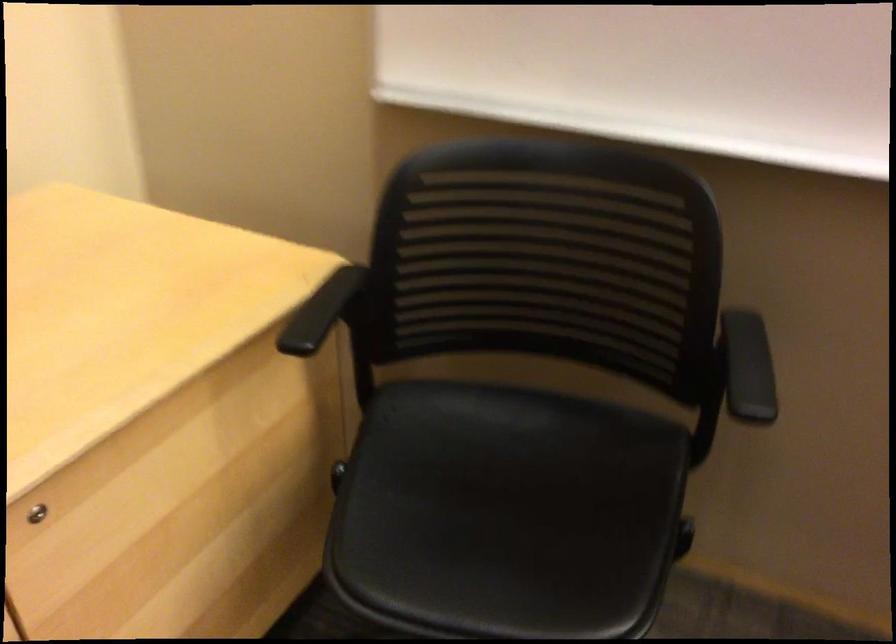
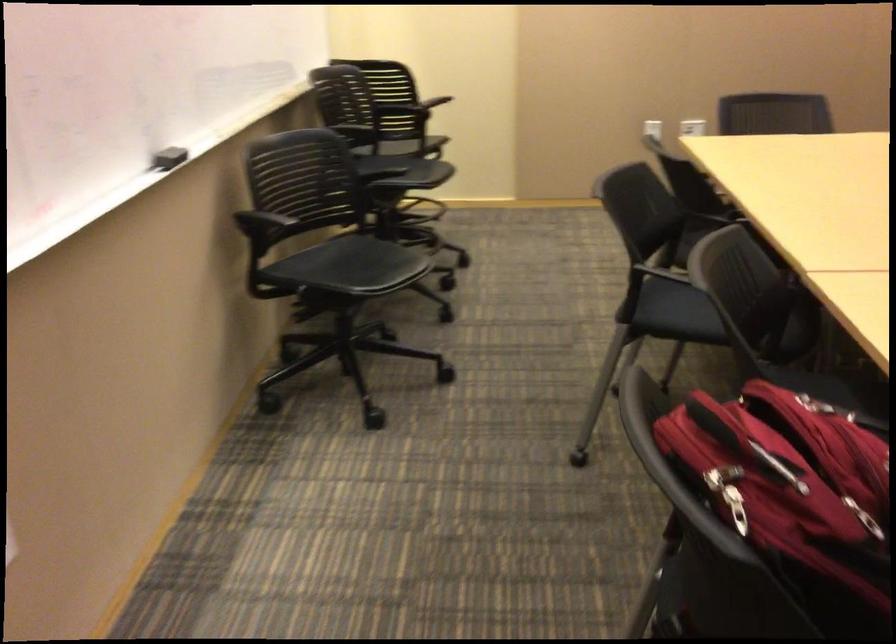
The images are taken continuously from a first-person perspective. In which direction is your viewpoint rotating?

The rotation direction of the camera is right-down.